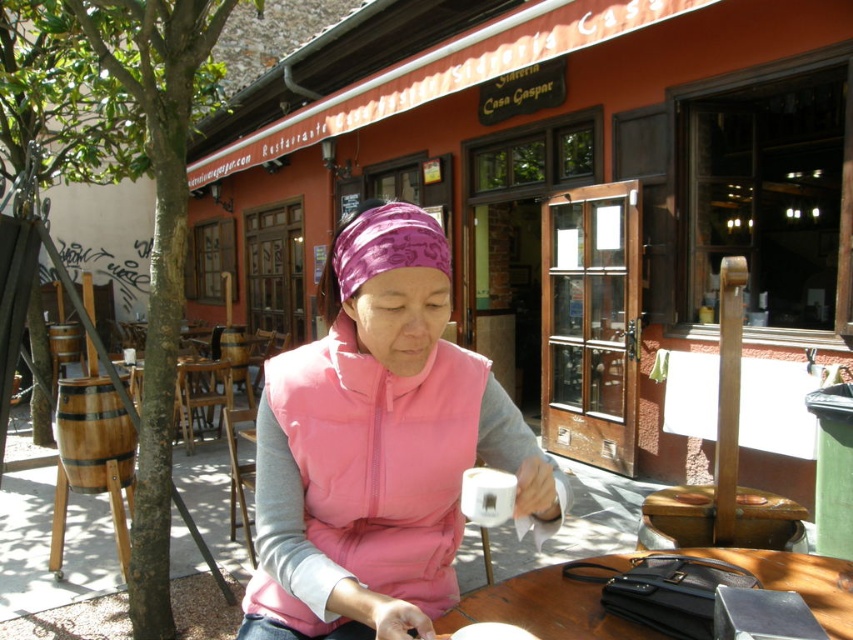
Question: Which point appears closest to the camera in this image?

Choices:
 (A) (364, 515)
 (B) (737, 564)

Answer: (A)

Question: Among these objects, which one is nearest to the camera?

Choices:
 (A) pink matte vest at center
 (B) wooden table at center

Answer: (A)

Question: Does pink matte vest at center have a smaller size compared to wooden table at center?

Choices:
 (A) no
 (B) yes

Answer: (A)

Question: Which object appears closest to the camera in this image?

Choices:
 (A) pink matte vest at center
 (B) wooden table at center

Answer: (A)

Question: Considering the relative positions of pink matte vest at center and wooden table at center in the image provided, where is pink matte vest at center located with respect to wooden table at center?

Choices:
 (A) right
 (B) left

Answer: (B)

Question: Does pink matte vest at center have a larger size compared to wooden table at center?

Choices:
 (A) yes
 (B) no

Answer: (A)